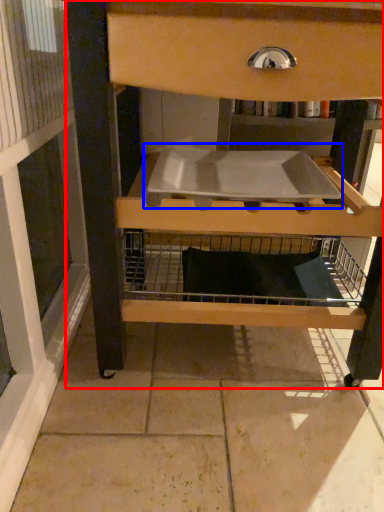
Question: Which of the following is the farthest to the observer, furniture (highlighted by a red box) or sink (highlighted by a blue box)?

Choices:
 (A) furniture
 (B) sink

Answer: (B)